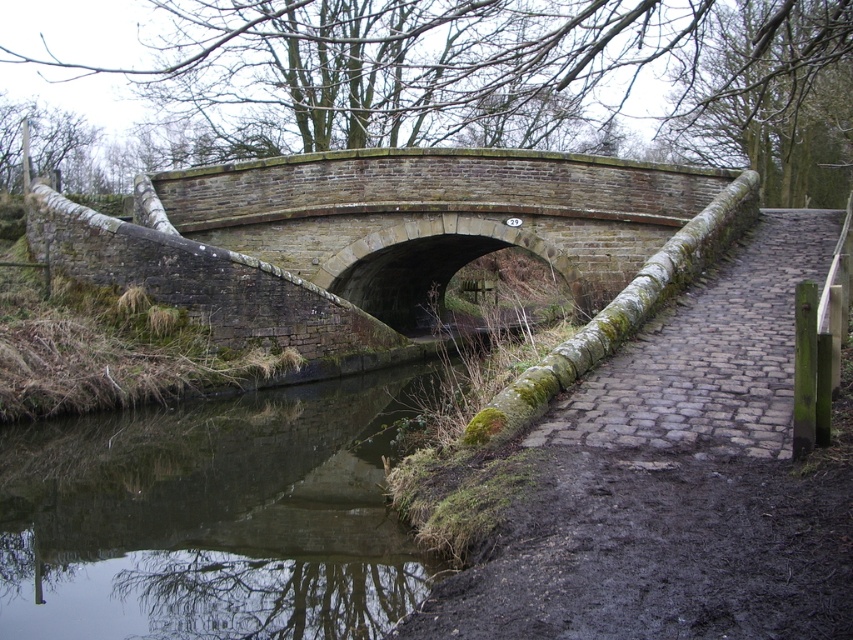
Question: Which object is positioned closest to the gray cobblestone path at center?

Choices:
 (A) brick stone bridge at center
 (B) green mossy water at lower left

Answer: (B)

Question: Can you confirm if green mossy water at lower left is positioned above gray cobblestone path at center?

Choices:
 (A) no
 (B) yes

Answer: (A)

Question: Can you confirm if brick stone bridge at center is positioned to the right of gray cobblestone path at center?

Choices:
 (A) yes
 (B) no

Answer: (B)

Question: Does brick stone bridge at center have a lesser width compared to gray cobblestone path at center?

Choices:
 (A) no
 (B) yes

Answer: (A)

Question: Which point is closer to the camera?

Choices:
 (A) green mossy water at lower left
 (B) gray cobblestone path at center

Answer: (A)

Question: Among these points, which one is farthest from the camera?

Choices:
 (A) (320, 586)
 (B) (328, 260)

Answer: (B)